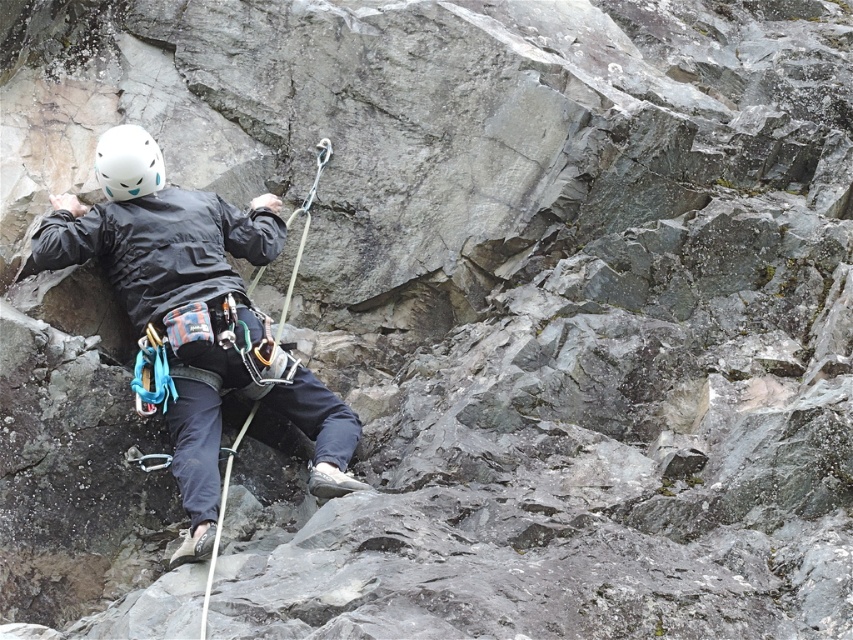
Question: Does matte black jacket at center appear on the right side of white matte helmet at upper left?

Choices:
 (A) yes
 (B) no

Answer: (B)

Question: Does matte black jacket at center come behind white matte helmet at upper left?

Choices:
 (A) no
 (B) yes

Answer: (B)

Question: Which object is farther from the camera taking this photo?

Choices:
 (A) matte black jacket at center
 (B) white matte helmet at upper left

Answer: (A)

Question: Where is matte black jacket at center located in relation to white matte helmet at upper left in the image?

Choices:
 (A) left
 (B) right

Answer: (A)